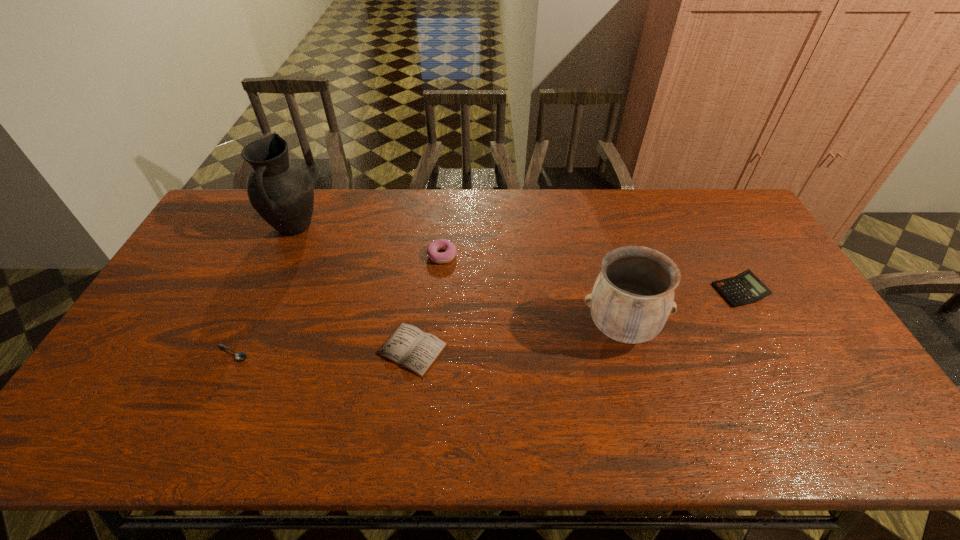
Select which object is the third closest to the soupspoon. Please provide its 2D coordinates. Your answer should be formatted as a tuple, i.e. [(x, y)], where the tuple contains the x and y coordinates of a point satisfying the conditions above.

[(441, 244)]

Image resolution: width=960 pixels, height=540 pixels. Identify the location of blank area in the image that satisfies the following two spatial constraints: 1. on the side of the pitcher with the handle; 2. on the left side of the second object from right to left. (248, 329).

Image resolution: width=960 pixels, height=540 pixels. Find the location of `free location that satisfies the following two spatial constraints: 1. on the side of the diary with the handle; 2. on the right side of the pitcher`. free location that satisfies the following two spatial constraints: 1. on the side of the diary with the handle; 2. on the right side of the pitcher is located at coordinates (238, 349).